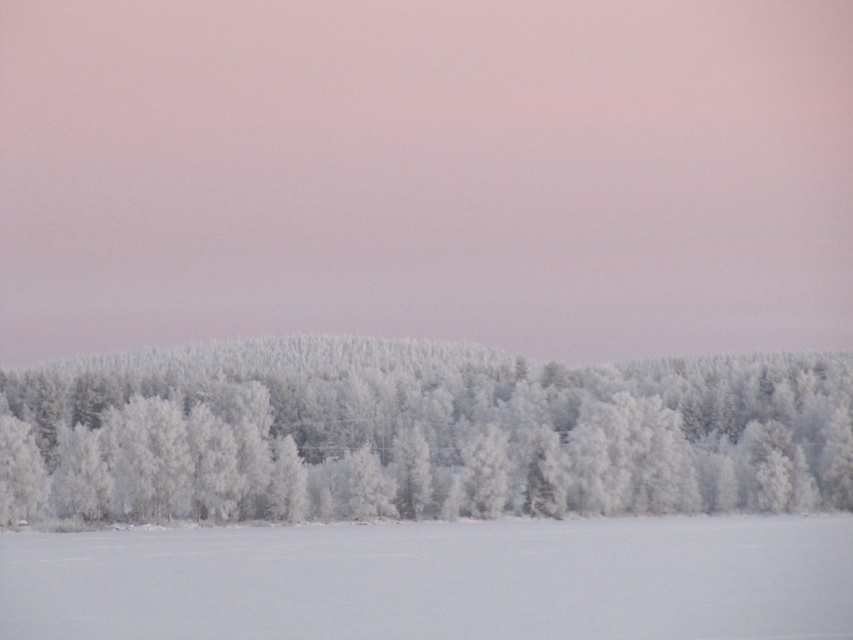
You are a photographer standing at the edge of a snowfield and want to capture the frosted white trees at center in your shot. If your camera has a focal length of 50mm, will the trees appear larger or smaller in the photo compared to when you are 100 feet closer to them?

The frosted white trees at center are 347.50 feet away from the camera. When you move 100 feet closer, the distance becomes 247.50 feet. Since objects appear larger as they are closer to the camera, the trees will appear smaller in the current position compared to when you are 100 feet closer.

You are standing in the winter landscape and want to walk towards the frosted white trees at center and the white frosty snow at lower center. Which object will you reach first?

You will reach the white frosty snow at lower center first because it is closer to you than the frosted white trees at center, which are further away.

You are an observer standing on the white frosty snow at lower center. Looking towards the frosted white trees at center, which direction should you face to see them?

The frosted white trees at center are positioned over the white frosty snow at lower center, so you should face upwards to see them.